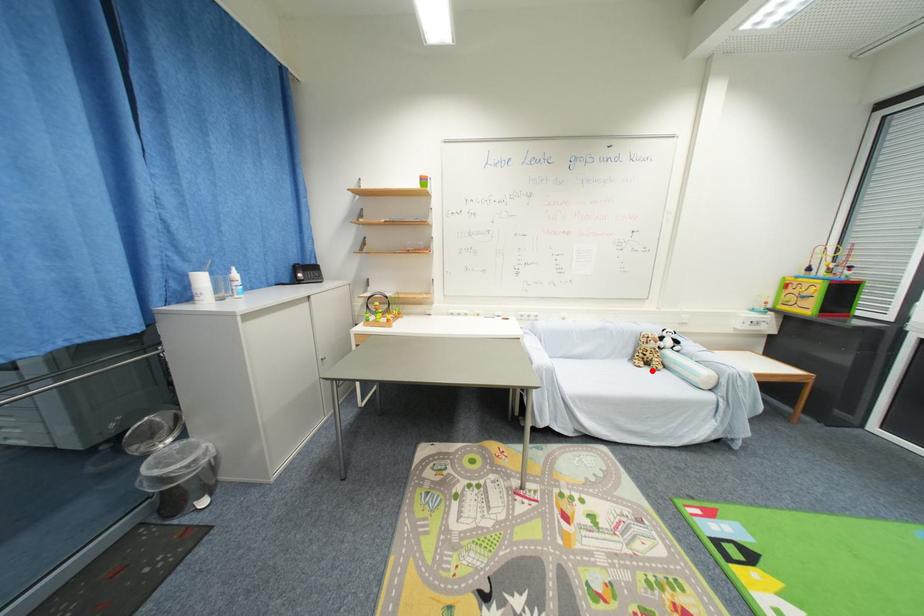
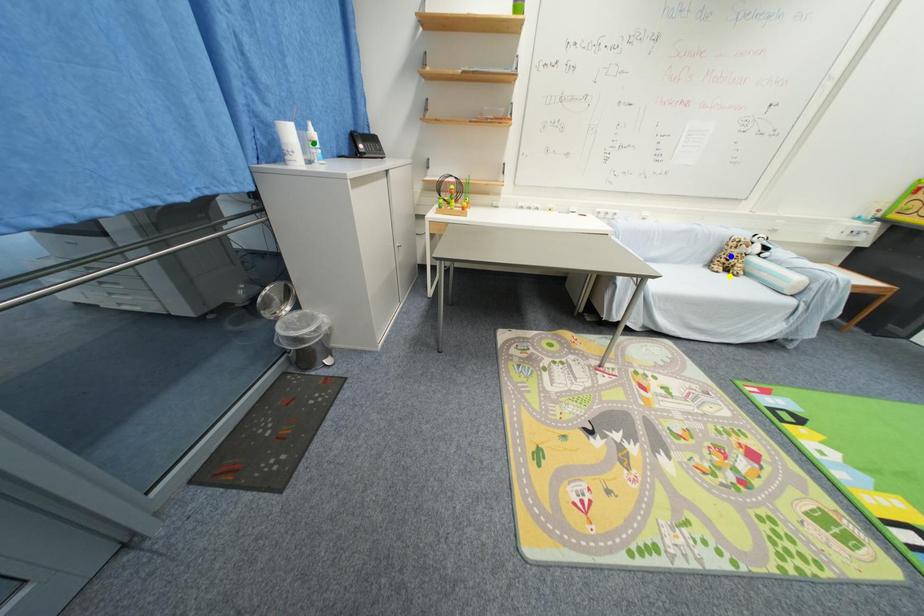
Question: I am providing you with two images of the same scene from different viewpoints. A red point is marked on the first image. You are given multiple points on the second image. Which spot in image 2 lines up with the point in image 1?

Choices:
 (A) yellow point
 (B) green point
 (C) blue point

Answer: (A)